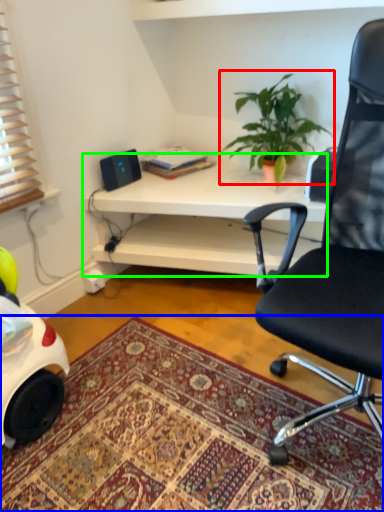
Question: Which is farther away from houseplant (highlighted by a red box)? mat (highlighted by a blue box) or desk (highlighted by a green box)?

Choices:
 (A) mat
 (B) desk

Answer: (A)